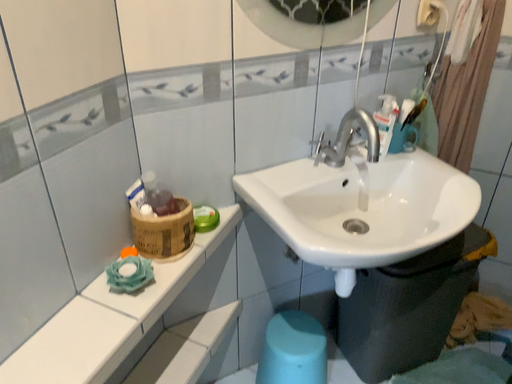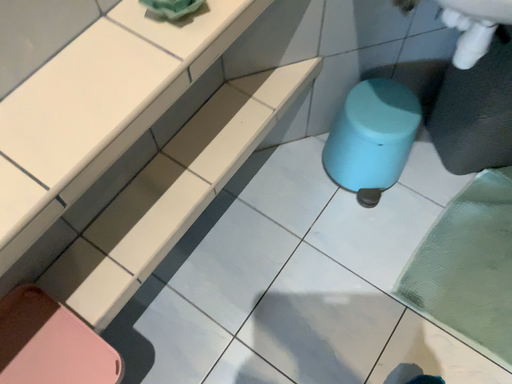
Question: Which way did the camera rotate in the video?

Choices:
 (A) rotated downward
 (B) rotated upward

Answer: (A)